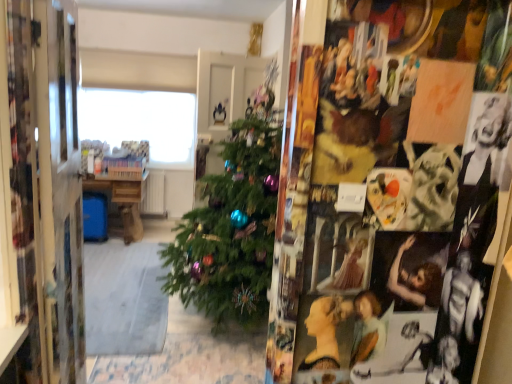
Question: From a real-world perspective, does transparent glass window at upper center sit lower than metallic silver mirror at left?

Choices:
 (A) yes
 (B) no

Answer: (B)

Question: Is there a large distance between transparent glass window at upper center and metallic silver mirror at left?

Choices:
 (A) yes
 (B) no

Answer: (A)

Question: Is transparent glass window at upper center wider than metallic silver mirror at left?

Choices:
 (A) no
 (B) yes

Answer: (A)

Question: Is transparent glass window at upper center at the right side of metallic silver mirror at left?

Choices:
 (A) no
 (B) yes

Answer: (A)

Question: From a real-world perspective, is transparent glass window at upper center on metallic silver mirror at left?

Choices:
 (A) yes
 (B) no

Answer: (A)

Question: From a real-world perspective, is wooden table at center positioned above or below transparent glass window at upper center?

Choices:
 (A) below
 (B) above

Answer: (A)

Question: Relative to transparent glass window at upper center, is wooden table at center in front or behind?

Choices:
 (A) behind
 (B) front

Answer: (A)

Question: Looking at their shapes, would you say wooden table at center is wider or thinner than transparent glass window at upper center?

Choices:
 (A) wide
 (B) thin

Answer: (A)

Question: Considering the positions of wooden table at center and transparent glass window at upper center in the image, is wooden table at center taller or shorter than transparent glass window at upper center?

Choices:
 (A) short
 (B) tall

Answer: (A)

Question: From the image's perspective, is transparent glass window at upper center above or below metallic silver mirror at left?

Choices:
 (A) below
 (B) above

Answer: (B)

Question: Relative to metallic silver mirror at left, is transparent glass window at upper center in front or behind?

Choices:
 (A) behind
 (B) front

Answer: (A)

Question: Is transparent glass window at upper center bigger or smaller than metallic silver mirror at left?

Choices:
 (A) big
 (B) small

Answer: (B)

Question: Considering the positions of transparent glass window at upper center and metallic silver mirror at left in the image, is transparent glass window at upper center taller or shorter than metallic silver mirror at left?

Choices:
 (A) short
 (B) tall

Answer: (A)

Question: Is point (113, 178) positioned closer to the camera than point (30, 127)?

Choices:
 (A) closer
 (B) farther

Answer: (B)

Question: Is wooden table at center in front of or behind metallic silver mirror at left in the image?

Choices:
 (A) behind
 (B) front

Answer: (A)